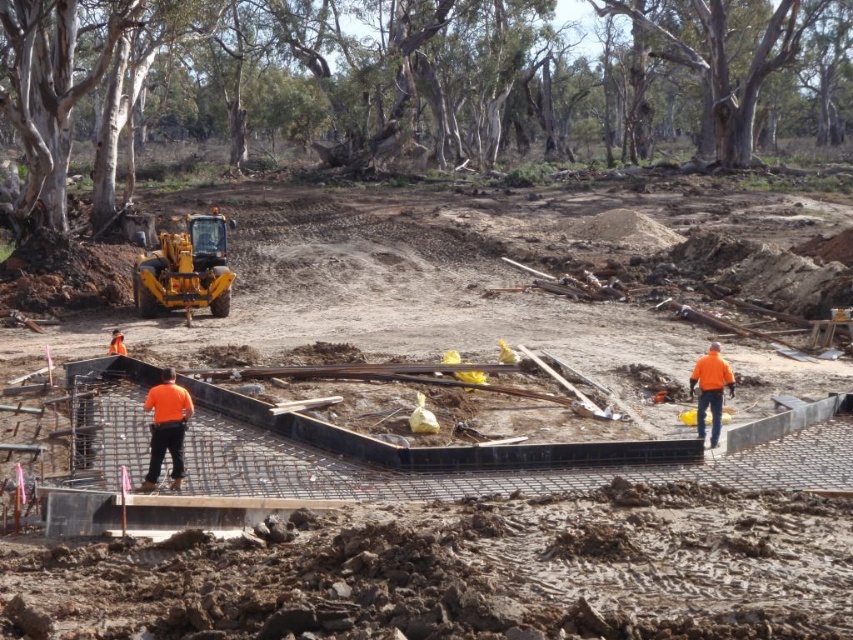
Is yellow metallic excavator at center positioned at the back of orange fabric construction worker at right?

Yes.

Between point (149, 310) and point (688, 387), which one is positioned behind?

Positioned behind is point (149, 310).

You are a GUI agent. You are given a task and a screenshot of the screen. Output one action in this format:
    pyautogui.click(x=<x>, y=<y>)
    Task: Click on the yellow metallic excavator at center
    This screenshot has width=853, height=640.
    Given the screenshot: What is the action you would take?
    pyautogui.click(x=184, y=269)

Which is more to the right, black concrete foundation at center or orange fabric construction worker at center?

Positioned to the right is black concrete foundation at center.

Consider the image. Between black concrete foundation at center and orange fabric construction worker at center, which one has less height?

With less height is orange fabric construction worker at center.

What do you see at coordinates (424, 464) in the screenshot?
I see `black concrete foundation at center` at bounding box center [424, 464].

This screenshot has width=853, height=640. I want to click on black concrete foundation at center, so click(x=424, y=464).

Does black concrete foundation at center have a lesser height compared to orange fabric construction worker at right?

Incorrect, black concrete foundation at center's height does not fall short of orange fabric construction worker at right's.

Which is more to the right, black concrete foundation at center or orange fabric construction worker at right?

orange fabric construction worker at right

Is point (544, 326) behind point (706, 397)?

Yes, it is behind point (706, 397).

Image resolution: width=853 pixels, height=640 pixels. I want to click on black concrete foundation at center, so click(424, 464).